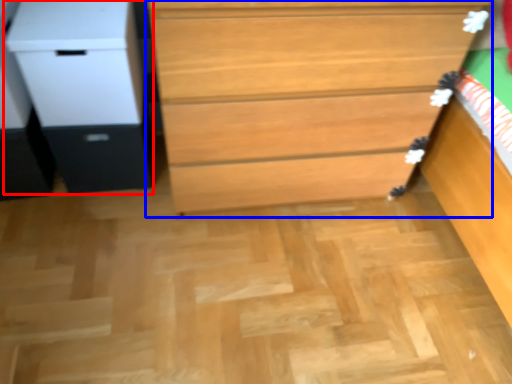
Question: Which point is closer to the camera, file cabinet (highlighted by a red box) or chest of drawers (highlighted by a blue box)?

Choices:
 (A) file cabinet
 (B) chest of drawers

Answer: (B)